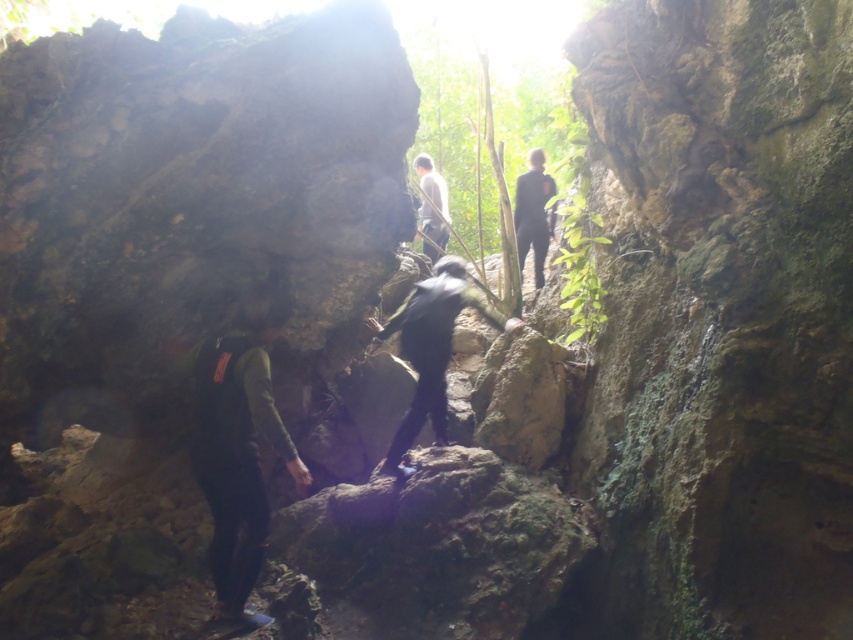
Does dark green fabric backpack at lower left have a greater width compared to dark gray fabric jacket at center?

Yes, dark green fabric backpack at lower left is wider than dark gray fabric jacket at center.

Which of these two, dark green fabric backpack at lower left or dark gray fabric jacket at center, stands taller?

dark green fabric backpack at lower left

Image resolution: width=853 pixels, height=640 pixels. What do you see at coordinates (239, 451) in the screenshot?
I see `dark green fabric backpack at lower left` at bounding box center [239, 451].

This screenshot has width=853, height=640. I want to click on dark green fabric backpack at lower left, so click(239, 451).

Is black matte jacket at center to the right of dark gray fabric jacket at center from the viewer's perspective?

Indeed, black matte jacket at center is positioned on the right side of dark gray fabric jacket at center.

Locate an element on the screen. black matte jacket at center is located at coordinates (532, 212).

This screenshot has height=640, width=853. I want to click on black matte jacket at center, so click(x=532, y=212).

Who is higher up, black matte climbing gear at center or dark gray fabric jacket at center?

dark gray fabric jacket at center is higher up.

The height and width of the screenshot is (640, 853). I want to click on black matte climbing gear at center, so click(x=430, y=349).